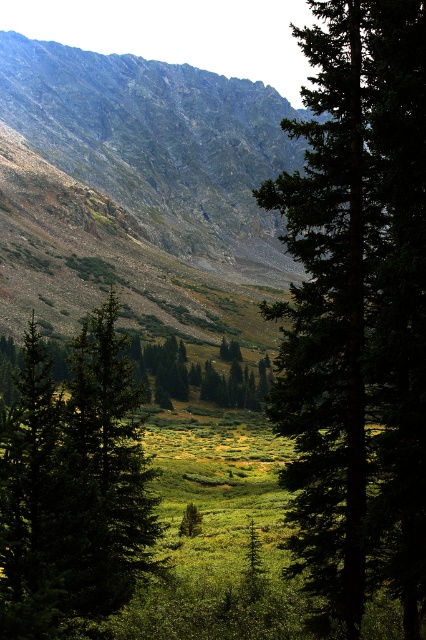
Question: Does rugged stone mountain at upper left appear over green textured tree at center?

Choices:
 (A) no
 (B) yes

Answer: (B)

Question: Which object appears farthest from the camera in this image?

Choices:
 (A) rugged stone mountain at upper left
 (B) green matte tree at center

Answer: (A)

Question: From the image, what is the correct spatial relationship of green matte tree at center in relation to green textured tree at center?

Choices:
 (A) below
 (B) above

Answer: (B)

Question: Does rugged stone mountain at upper left have a greater width compared to green textured tree at center?

Choices:
 (A) no
 (B) yes

Answer: (B)

Question: Estimate the real-world distances between objects in this image. Which object is closer to the green matte tree at center?

Choices:
 (A) green textured tree at center
 (B) rugged stone mountain at upper left

Answer: (A)

Question: Among these objects, which one is nearest to the camera?

Choices:
 (A) green matte tree at center
 (B) green textured tree at center

Answer: (B)